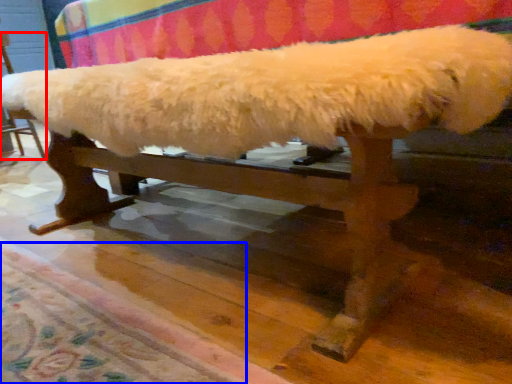
Question: Among these objects, which one is farthest to the camera, furniture (highlighted by a red box) or mat (highlighted by a blue box)?

Choices:
 (A) furniture
 (B) mat

Answer: (A)